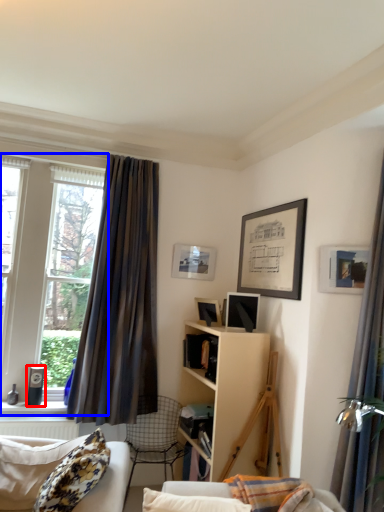
Question: Which of the following is the farthest to the observer, speaker (highlighted by a red box) or window (highlighted by a blue box)?

Choices:
 (A) speaker
 (B) window

Answer: (A)